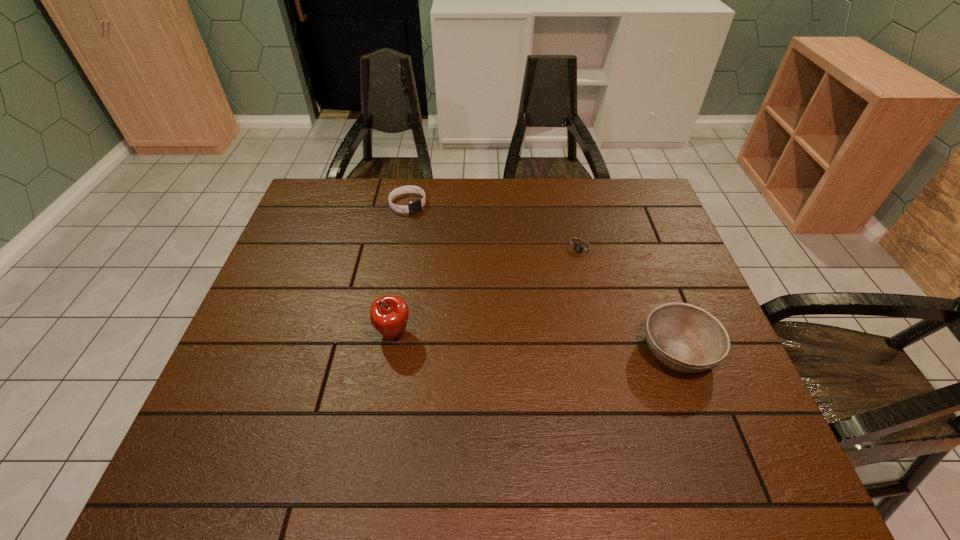
Identify the location of the tallest object. (389, 314).

Find the location of a particular element. the rightmost object is located at coordinates (686, 338).

I want to click on the third shortest object, so click(x=686, y=338).

The image size is (960, 540). I want to click on the third nearest object, so click(581, 248).

At what (x,y) coordinates should I click in order to perform the action: click on the shortest object. Please return your answer as a coordinate pair (x, y). This screenshot has height=540, width=960. Looking at the image, I should click on (581, 248).

The height and width of the screenshot is (540, 960). I want to click on wristband, so click(415, 206).

This screenshot has width=960, height=540. In order to click on the third tallest object in this screenshot , I will do `click(415, 206)`.

You are a GUI agent. You are given a task and a screenshot of the screen. Output one action in this format:
    pyautogui.click(x=<x>, y=<y>)
    Task: Click on the vacant space located on the back of the tallest object
    This screenshot has height=540, width=960.
    Given the screenshot: What is the action you would take?
    pyautogui.click(x=412, y=224)

Find the location of a particular element. free space located on the back of the third shortest object is located at coordinates (631, 224).

This screenshot has height=540, width=960. Identify the location of free location located on the face of the second object from right to left. (503, 346).